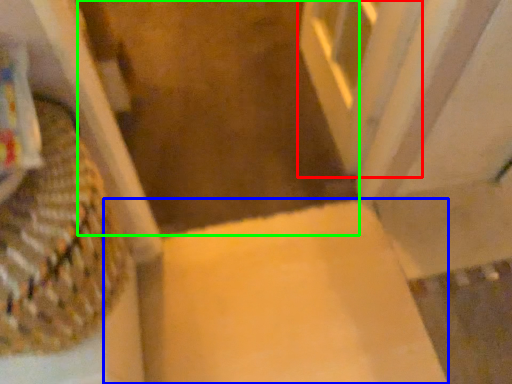
Question: Based on their relative distances, which object is nearer to screen door (highlighted by a red box)? Choose from cardboard box (highlighted by a blue box) and aisle (highlighted by a green box).

Choices:
 (A) cardboard box
 (B) aisle

Answer: (B)